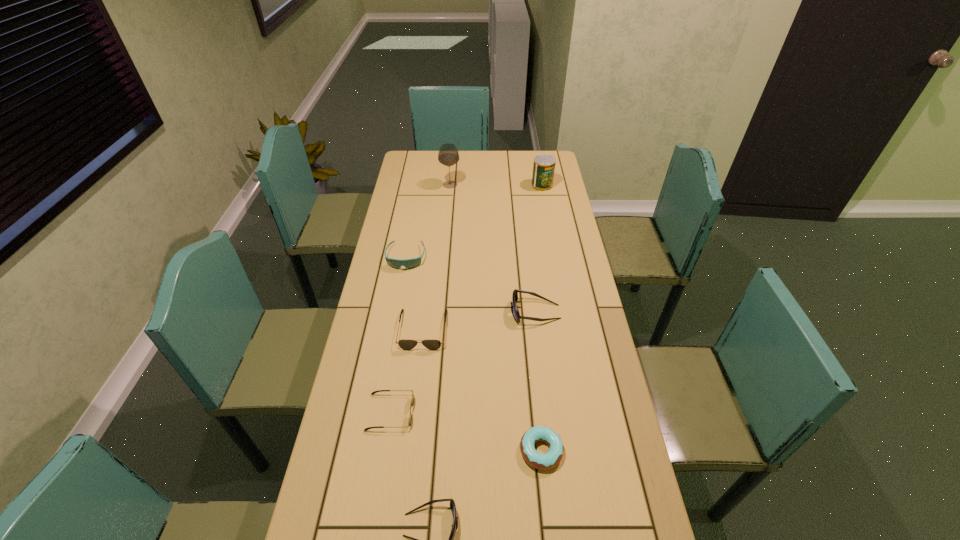
You are a GUI agent. You are given a task and a screenshot of the screen. Output one action in this format:
    pyautogui.click(x=<x>, y=<y>)
    Task: Click on the tallest object
    This screenshot has width=960, height=540.
    Given the screenshot: What is the action you would take?
    [448, 155]

Where is `wineglass`? The height and width of the screenshot is (540, 960). wineglass is located at coordinates (448, 155).

This screenshot has height=540, width=960. Identify the location of can. (544, 165).

This screenshot has height=540, width=960. I want to click on the bigger blue sunglasses, so click(516, 315).

Image resolution: width=960 pixels, height=540 pixels. In order to click on the tallest sunglasses in this screenshot , I will do `click(516, 315)`.

This screenshot has width=960, height=540. I want to click on the third farthest object, so click(411, 263).

This screenshot has height=540, width=960. Find the location of `cyan sunglasses`. cyan sunglasses is located at coordinates (411, 263).

Locate an element on the screen. The width and height of the screenshot is (960, 540). the bigger black sunglasses is located at coordinates (406, 344).

You are a GUI agent. You are given a task and a screenshot of the screen. Output one action in this format:
    pyautogui.click(x=<x>, y=<y>)
    Task: Click on the smaller black sunglasses
    
    Given the screenshot: What is the action you would take?
    pyautogui.click(x=412, y=400)

The width and height of the screenshot is (960, 540). Identify the location of the shortest sunglasses. (412, 400).